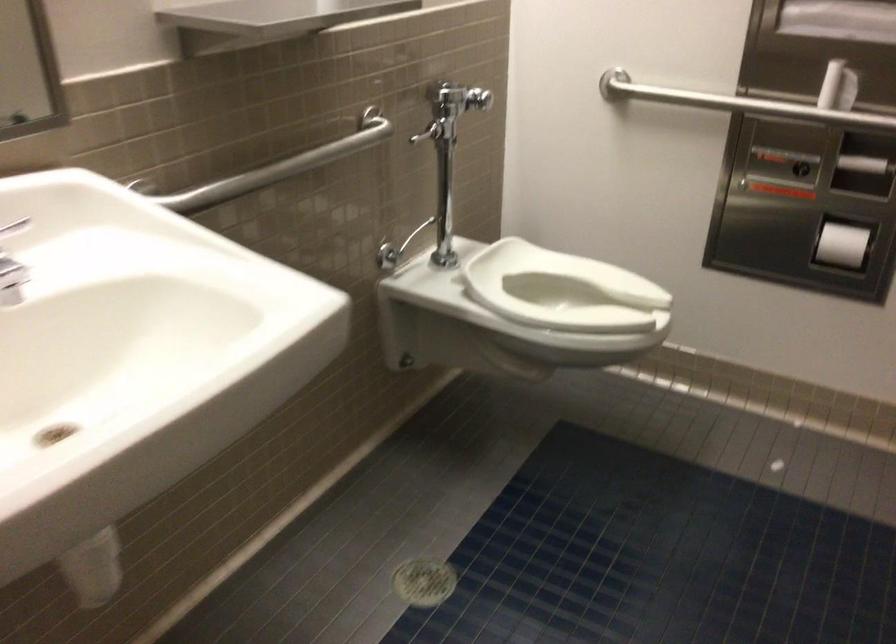
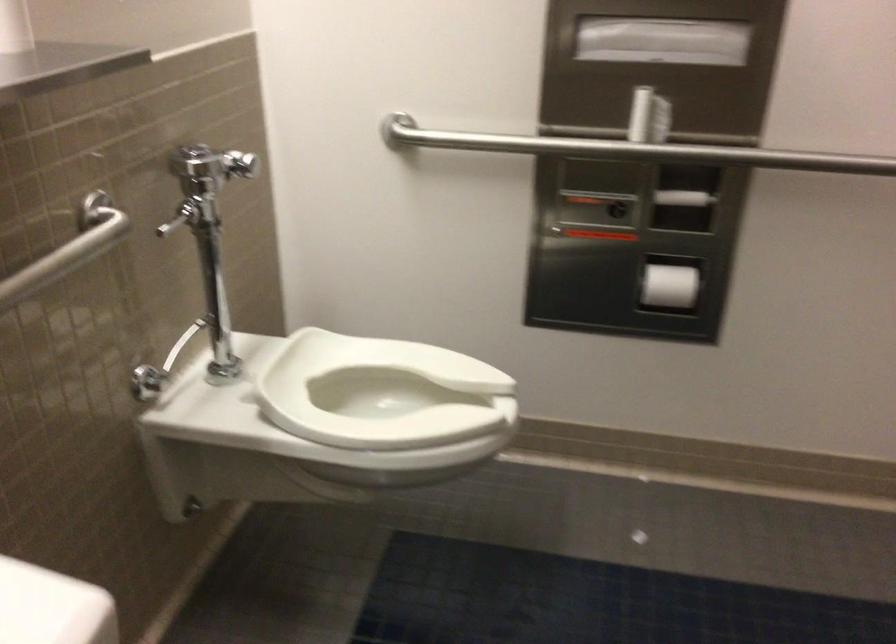
Find the pixel in the second image that matches the point at 814,108 in the first image.

(630, 149)